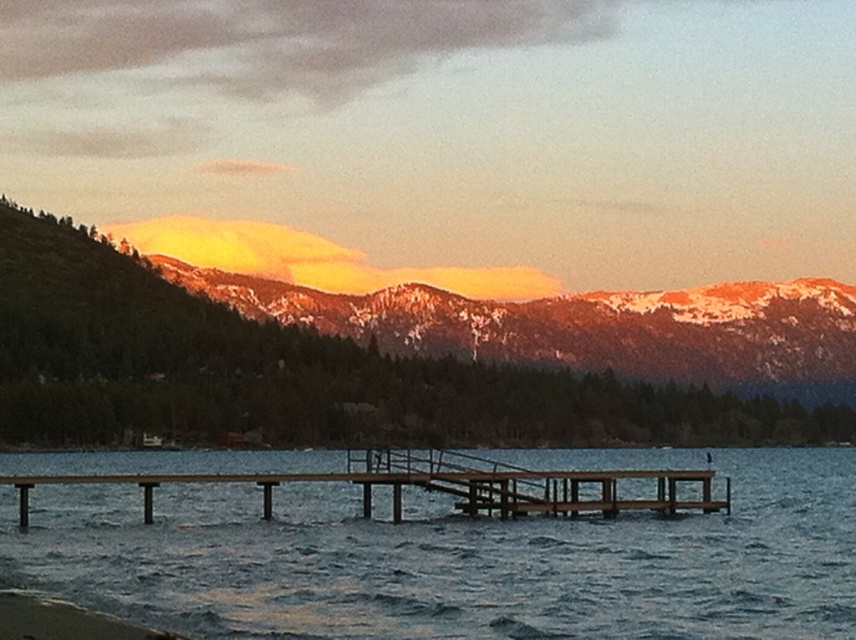
Question: Does wooden dock at center lie behind smooth sand at lower left?

Choices:
 (A) yes
 (B) no

Answer: (A)

Question: Among these objects, which one is nearest to the camera?

Choices:
 (A) sandy brown mountains at upper center
 (B) smooth sand at lower left

Answer: (B)

Question: Which of the following is the farthest from the observer?

Choices:
 (A) (574, 483)
 (B) (837, 461)

Answer: (B)

Question: Is smooth blue water at center in front of smooth sand at lower left?

Choices:
 (A) yes
 (B) no

Answer: (B)

Question: Is sandy brown mountains at upper center wider than smooth sand at lower left?

Choices:
 (A) no
 (B) yes

Answer: (B)

Question: Among these objects, which one is nearest to the camera?

Choices:
 (A) smooth sand at lower left
 (B) smooth blue water at center

Answer: (A)